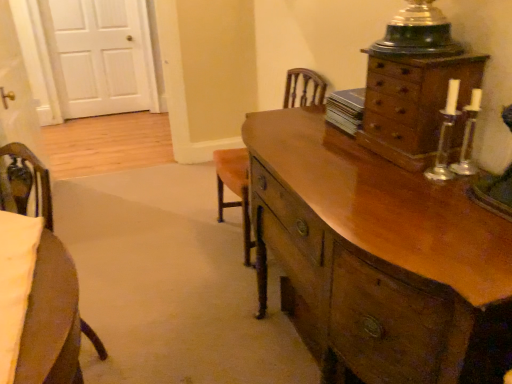
Question: Considering the relative sizes of wooden chest of drawers at upper right, the 2th chest of drawers positioned from the bottom, and wooden armchair at center in the image provided, is wooden chest of drawers at upper right, the 2th chest of drawers positioned from the bottom, bigger than wooden armchair at center?

Choices:
 (A) yes
 (B) no

Answer: (B)

Question: From a real-world perspective, is wooden chest of drawers at upper right, the 2th chest of drawers positioned from the bottom, beneath wooden armchair at center?

Choices:
 (A) yes
 (B) no

Answer: (B)

Question: Is wooden chest of drawers at upper right, which is the 1th chest of drawers from top to bottom, not inside wooden armchair at center?

Choices:
 (A) yes
 (B) no

Answer: (A)

Question: Does wooden chest of drawers at upper right, the 2th chest of drawers positioned from the bottom, turn towards wooden armchair at center?

Choices:
 (A) yes
 (B) no

Answer: (B)

Question: Is wooden chest of drawers at upper right, which is the 1th chest of drawers from top to bottom, shorter than wooden armchair at center?

Choices:
 (A) yes
 (B) no

Answer: (A)

Question: From the image's perspective, is wooden chest of drawers at upper right, the 2th chest of drawers positioned from the bottom, below wooden armchair at center?

Choices:
 (A) yes
 (B) no

Answer: (B)

Question: Is wooden armchair at center at the right side of shiny brown wooden chest of drawers at right, placed as the 2th chest of drawers when sorted from top to bottom?

Choices:
 (A) no
 (B) yes

Answer: (A)

Question: Is wooden armchair at center next to shiny brown wooden chest of drawers at right, placed as the 2th chest of drawers when sorted from top to bottom, and touching it?

Choices:
 (A) yes
 (B) no

Answer: (B)

Question: From the image's perspective, is wooden armchair at center located above shiny brown wooden chest of drawers at right, placed as the 2th chest of drawers when sorted from top to bottom?

Choices:
 (A) yes
 (B) no

Answer: (A)

Question: Could you tell me if wooden armchair at center is turned towards shiny brown wooden chest of drawers at right, acting as the first chest of drawers starting from the bottom?

Choices:
 (A) yes
 (B) no

Answer: (B)

Question: Can you confirm if wooden armchair at center is shorter than shiny brown wooden chest of drawers at right, placed as the 2th chest of drawers when sorted from top to bottom?

Choices:
 (A) yes
 (B) no

Answer: (B)

Question: Can you confirm if wooden armchair at center is taller than shiny brown wooden chest of drawers at right, placed as the 2th chest of drawers when sorted from top to bottom?

Choices:
 (A) yes
 (B) no

Answer: (A)

Question: Considering the relative positions of wooden armchair at center and white wood door at upper left in the image provided, is wooden armchair at center to the left of white wood door at upper left from the viewer's perspective?

Choices:
 (A) yes
 (B) no

Answer: (B)